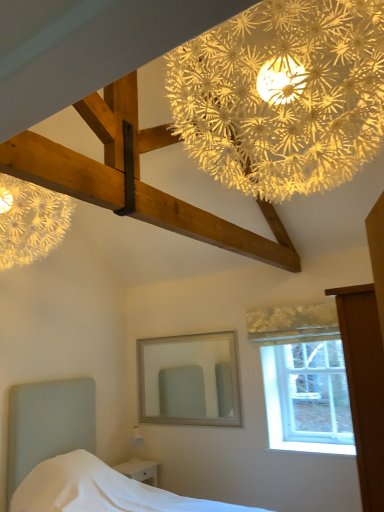
What are the coordinates of `empty space that is ontop of white wooden mirror at center (from a real-world perspective)` in the screenshot? It's located at (189, 332).